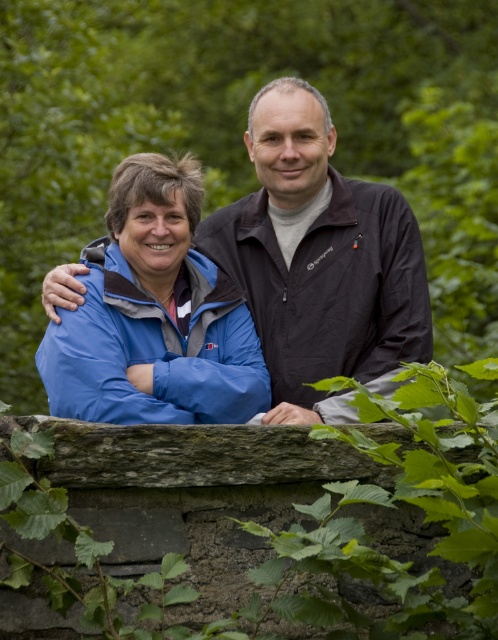
Question: Is blue fabric jacket at center thinner than matte blue jacket at left?

Choices:
 (A) no
 (B) yes

Answer: (B)

Question: Which of the following is the closest to the observer?

Choices:
 (A) (208, 396)
 (B) (313, 321)

Answer: (A)

Question: Can you confirm if blue fabric jacket at center is positioned below matte blue jacket at left?

Choices:
 (A) yes
 (B) no

Answer: (B)

Question: Which point appears farthest from the camera in this image?

Choices:
 (A) (318, 224)
 (B) (55, 371)

Answer: (A)

Question: Which point appears closest to the camera in this image?

Choices:
 (A) (182, 204)
 (B) (416, 243)

Answer: (A)

Question: Is blue fabric jacket at center positioned behind matte blue jacket at left?

Choices:
 (A) no
 (B) yes

Answer: (B)